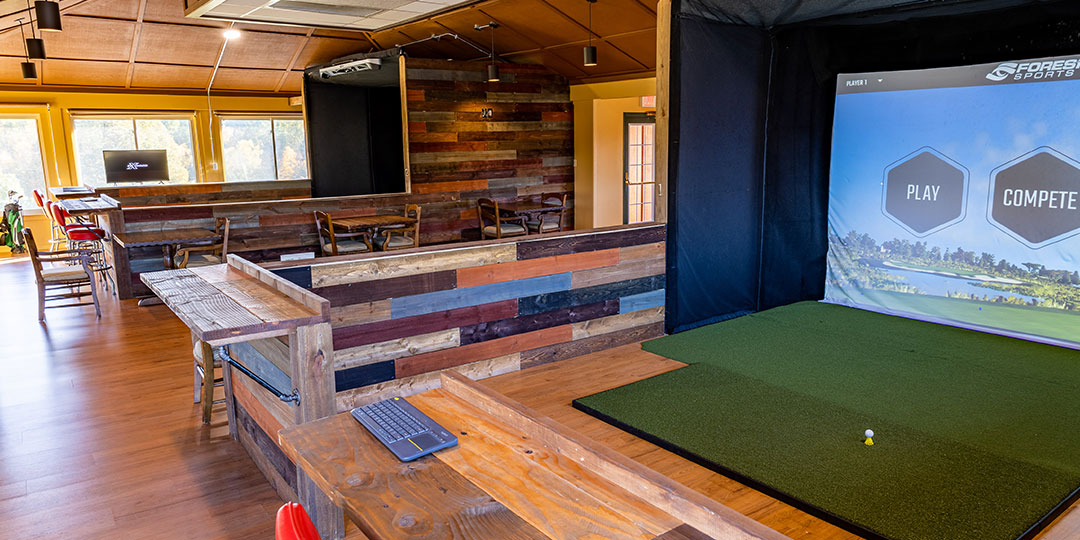
In order to click on windows in this screenshot , I will do `click(235, 141)`, `click(171, 130)`, `click(108, 128)`, `click(298, 139)`.